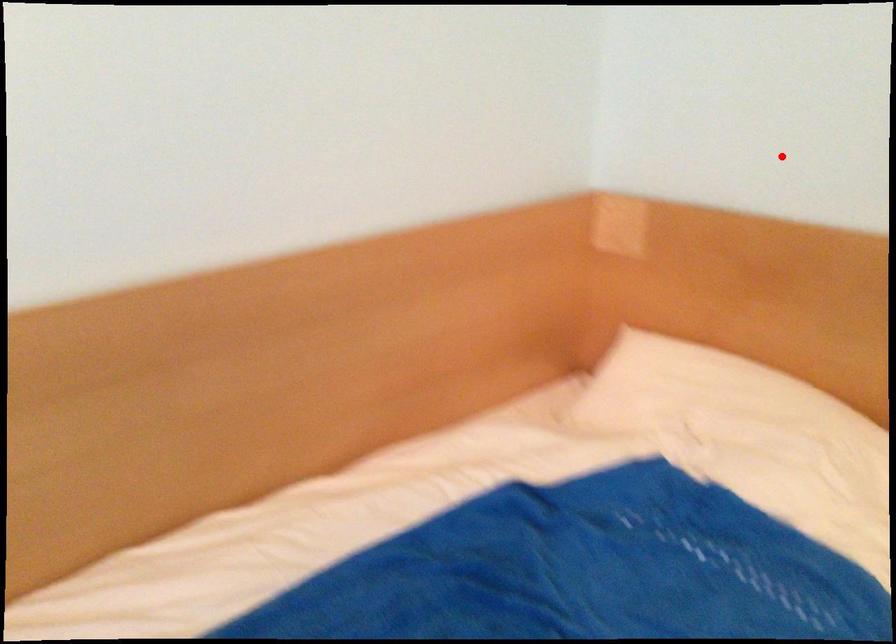
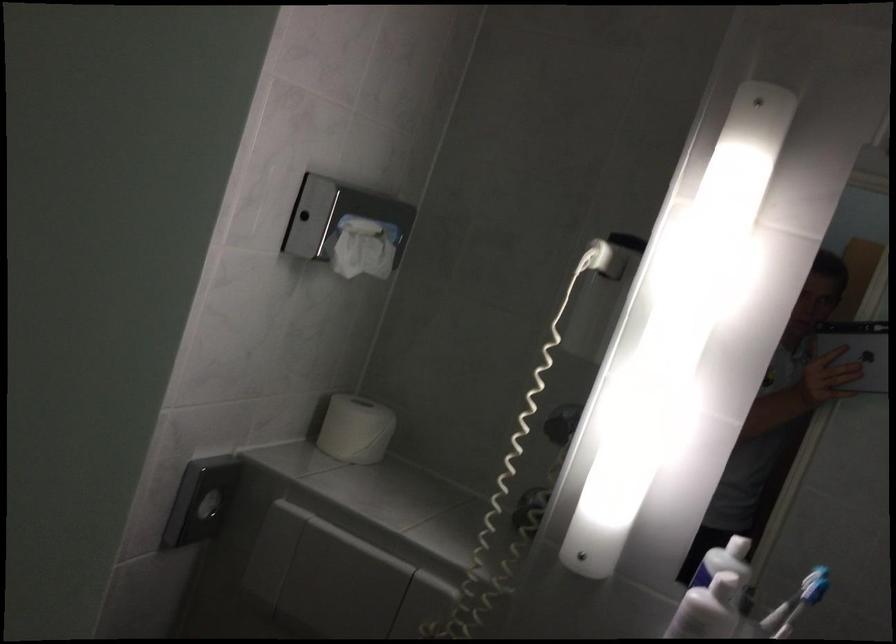
Question: I am providing you with two images of the same scene from different viewpoints. A red point is marked on the first image. At the location where the point appears in image 1, is it still visible in image 2?

Choices:
 (A) Yes
 (B) No

Answer: (A)